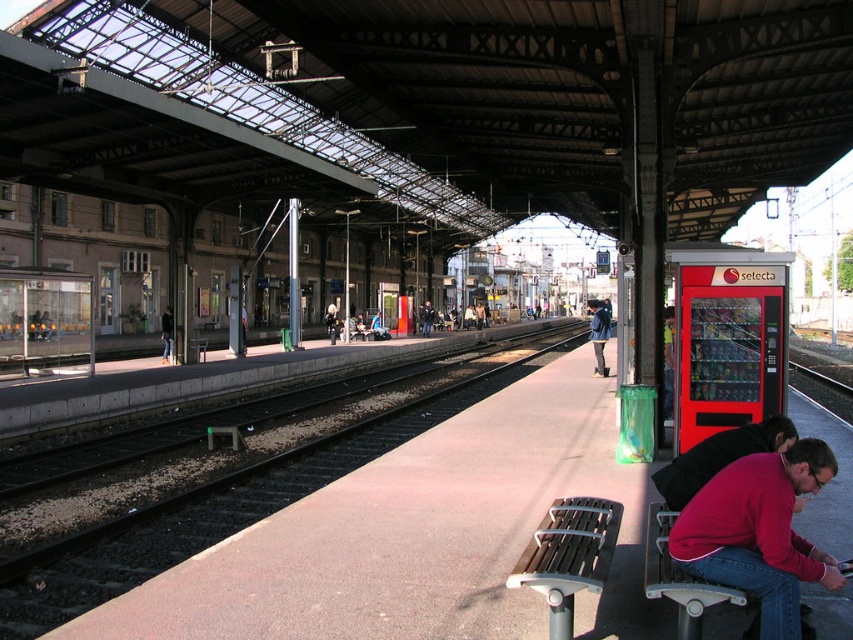
You are standing on the train station platform and want to sit down. There is a bench near the red vending machine on the right. However, you notice the black asphalt train track at center and the dark blue jacket at center. Which object is closer to the bench?

The dark blue jacket at center is closer to the bench because it is positioned above the black asphalt train track at center, indicating it is nearer in the scene.

You are a traveler with a large backpack and need to find a place to sit on the platform. The metallic silver bench at lower right and the dark blue jacket at center are both in your view. Which seating option has more space available for you to sit comfortably?

The dark blue jacket at center has more space available because the metallic silver bench at lower right occupies less space than the dark blue jacket at center.